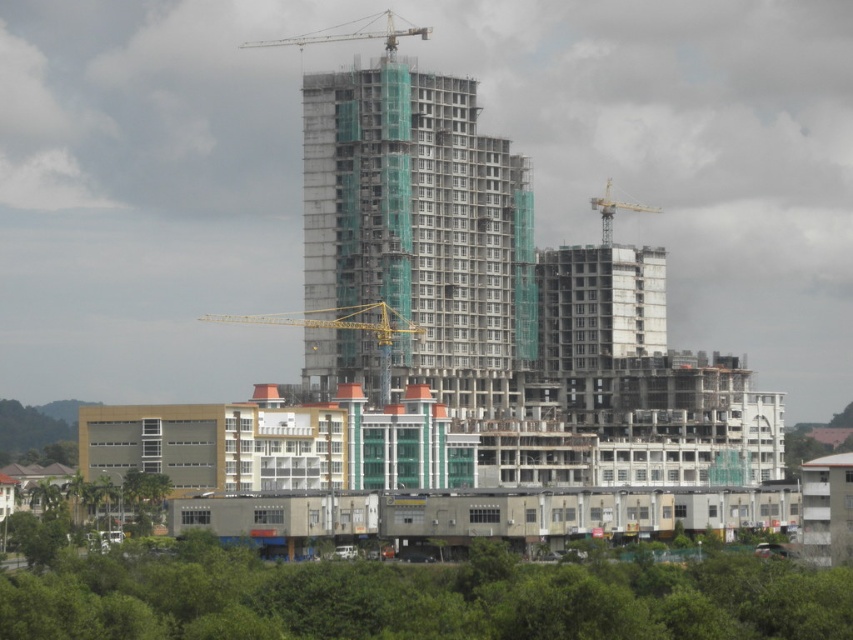
Based on the photo, you are a delivery truck driver approaching the construction site. You need to deliver supplies to the lower residential buildings. While navigating, you notice the green leafy trees at lower center and the metallic gray crane at upper center. Which object should you avoid driving near to ensure a safe path to the residential buildings?

You should avoid driving near the metallic gray crane at upper center because the green leafy trees at lower center is to the right of it, so the crane is closer to the central area where the residential buildings are located, making it a safer path to navigate around.

You are a construction worker standing at the base of the yellow metallic crane at center. You need to move to the green leafy trees at lower center for a break. Which direction should you walk to reach the trees?

The green leafy trees at lower center are located below the yellow metallic crane at center, so you should walk downward or towards the lower part of the construction site to reach them.

You are a drone operator tasked with capturing aerial footage of the construction site. You need to fly your drone from the point at coordinates point (459, 593) to the point at coordinates point (380, 300). Given that the drone can only descend or maintain altitude during its flight path, will it be able to reach the second point without ascending?

Point (459, 593) is closer to the camera than point (380, 300). Since the drone can only descend or maintain altitude, and the second point is further away from the camera, it would require ascending to reach it, which is not allowed. Therefore, the drone cannot reach the second point without ascending.